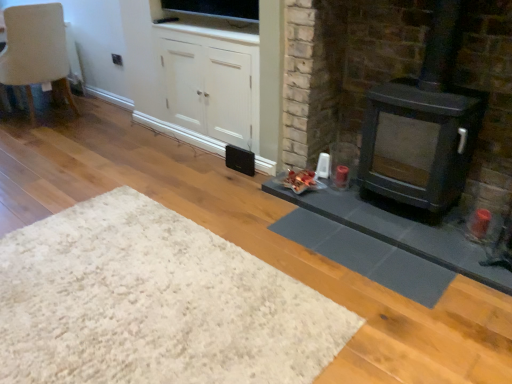
Question: Is white matte cabinet at center completely or partially outside of matte black stove at right?

Choices:
 (A) yes
 (B) no

Answer: (A)

Question: Considering the relative sizes of white matte cabinet at center and matte black stove at right in the image provided, is white matte cabinet at center taller than matte black stove at right?

Choices:
 (A) no
 (B) yes

Answer: (A)

Question: Does white matte cabinet at center have a lesser height compared to matte black stove at right?

Choices:
 (A) yes
 (B) no

Answer: (A)

Question: Considering the relative sizes of white matte cabinet at center and matte black stove at right in the image provided, is white matte cabinet at center thinner than matte black stove at right?

Choices:
 (A) yes
 (B) no

Answer: (A)

Question: Is white matte cabinet at center beside matte black stove at right?

Choices:
 (A) yes
 (B) no

Answer: (B)

Question: From the image's perspective, is white matte cabinet at center beneath matte black stove at right?

Choices:
 (A) no
 (B) yes

Answer: (A)

Question: Could you tell me if matte black wood burning stove at right is facing black matte speaker at center?

Choices:
 (A) yes
 (B) no

Answer: (B)

Question: Is matte black wood burning stove at right next to black matte speaker at center and touching it?

Choices:
 (A) no
 (B) yes

Answer: (A)

Question: Is matte black wood burning stove at right located outside black matte speaker at center?

Choices:
 (A) yes
 (B) no

Answer: (A)

Question: Does matte black wood burning stove at right lie behind black matte speaker at center?

Choices:
 (A) no
 (B) yes

Answer: (A)

Question: From the image's perspective, is matte black wood burning stove at right located above black matte speaker at center?

Choices:
 (A) yes
 (B) no

Answer: (A)

Question: From a real-world perspective, is matte black wood burning stove at right on top of black matte speaker at center?

Choices:
 (A) no
 (B) yes

Answer: (B)

Question: Does beige fabric chair at upper left have a smaller size compared to white shaggy rug at lower left?

Choices:
 (A) no
 (B) yes

Answer: (A)